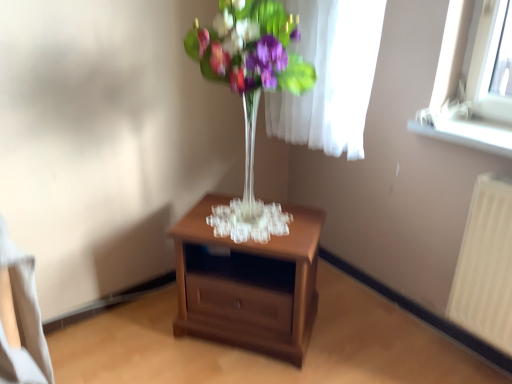
The image size is (512, 384). What are the coordinates of `vacant space in between white plastic radiator at right and brown wooden nightstand at center` in the screenshot? It's located at (x=375, y=346).